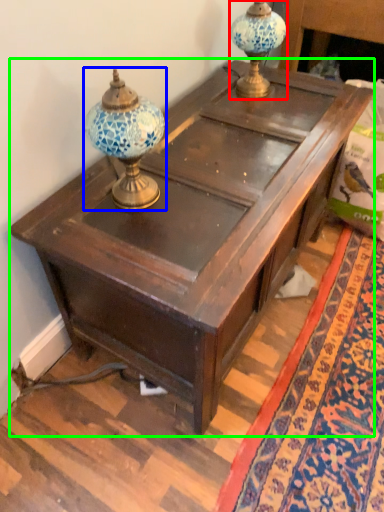
Question: Based on their relative distances, which object is nearer to candle holder (highlighted by a red box)? Choose from candle holder (highlighted by a blue box) and table (highlighted by a green box).

Choices:
 (A) candle holder
 (B) table

Answer: (B)